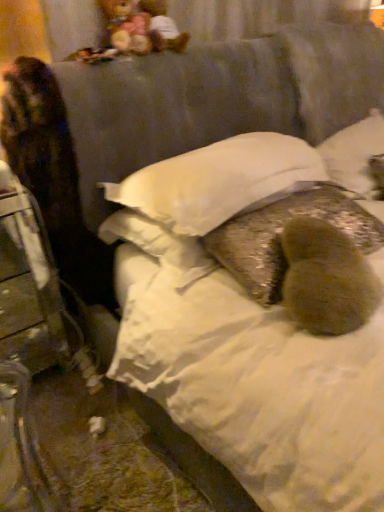
Question: In terms of width, does multicolored plush at upper left, the second figurine from the right, look wider or thinner when compared to white soft pillow at center, which is the third pillow in right-to-left order?

Choices:
 (A) thin
 (B) wide

Answer: (A)

Question: Considering their positions, is multicolored plush at upper left, placed as the 1th figurine when sorted from left to right, located in front of or behind white soft pillow at center, which is the third pillow in right-to-left order?

Choices:
 (A) behind
 (B) front

Answer: (A)

Question: Considering the real-world distances, which object is closest to the multicolored plush at upper left, placed as the 1th figurine when sorted from left to right?

Choices:
 (A) matte plastic figurine at upper center, positioned as the 2th figurine in left-to-right order
 (B) fuzzy brown pillow at center
 (C) fuzzy brown pillow at center, marked as the 2th pillow in a right-to-left arrangement
 (D) silky white pillow at upper right, the third pillow positioned from the left
 (E) metallic silver chair at left

Answer: (A)

Question: Which is farther from the fuzzy brown pillow at center, which is the second pillow from left to right?

Choices:
 (A) fuzzy brown pillow at center
 (B) multicolored plush at upper left, placed as the 1th figurine when sorted from left to right
 (C) matte plastic figurine at upper center, positioned as the 2th figurine in left-to-right order
 (D) white soft pillow at center, which is the third pillow in right-to-left order
 (E) metallic silver chair at left

Answer: (E)